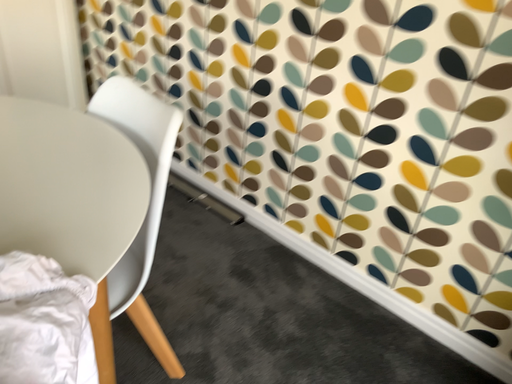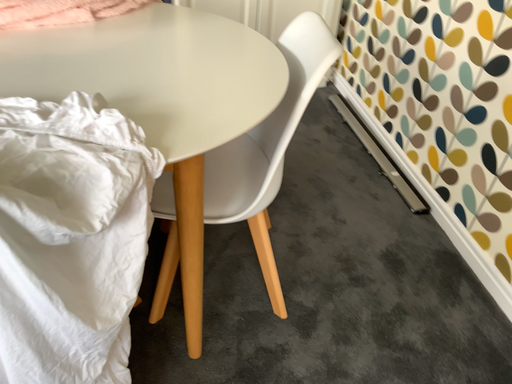
Question: How did the camera likely rotate when shooting the video?

Choices:
 (A) rotated left
 (B) rotated right

Answer: (A)